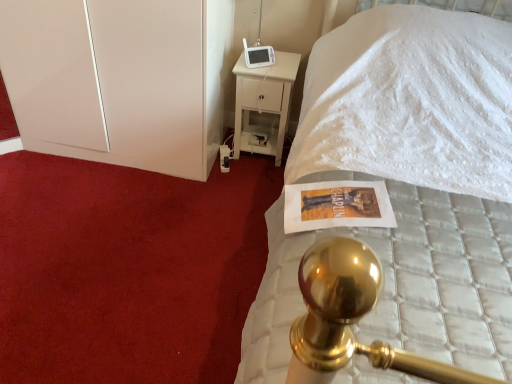
Question: From their relative heights in the image, would you say white quilted mattress at upper right is taller or shorter than white glossy dresser at left?

Choices:
 (A) short
 (B) tall

Answer: (B)

Question: Is white quilted mattress at upper right in front of or behind white glossy dresser at left in the image?

Choices:
 (A) front
 (B) behind

Answer: (A)

Question: Choose the correct answer: Is white quilted mattress at upper right inside white glossy dresser at left or outside it?

Choices:
 (A) outside
 (B) inside

Answer: (A)

Question: Is white glossy dresser at left taller or shorter than white quilted mattress at upper right?

Choices:
 (A) tall
 (B) short

Answer: (B)

Question: Is point (154, 142) closer or farther from the camera than point (465, 188)?

Choices:
 (A) closer
 (B) farther

Answer: (B)

Question: Looking at the image, does white glossy dresser at left seem bigger or smaller compared to white quilted mattress at upper right?

Choices:
 (A) big
 (B) small

Answer: (B)

Question: Is white glossy dresser at left inside the boundaries of white quilted mattress at upper right, or outside?

Choices:
 (A) inside
 (B) outside

Answer: (B)